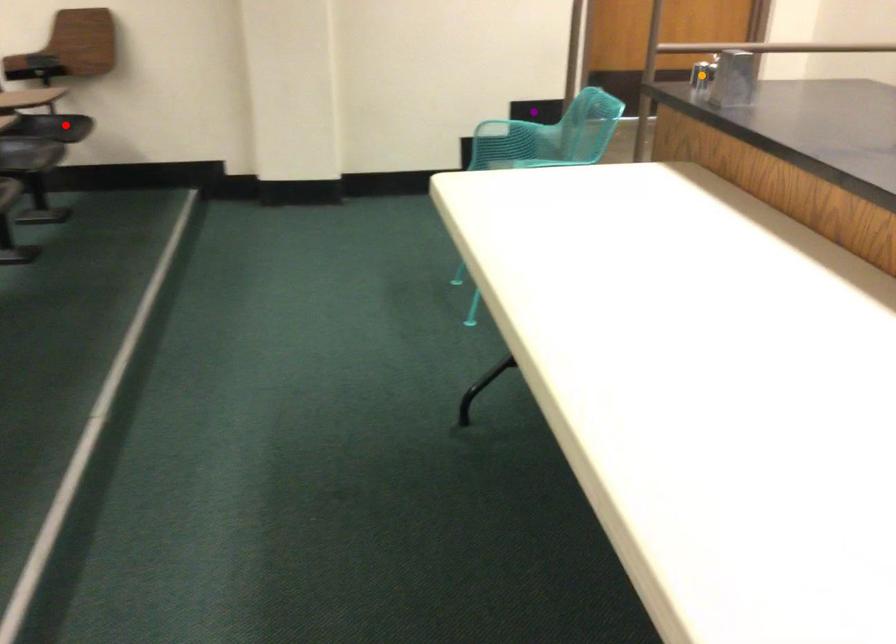
Order these from farthest to nearest:
A) purple point
B) red point
C) orange point

1. purple point
2. red point
3. orange point